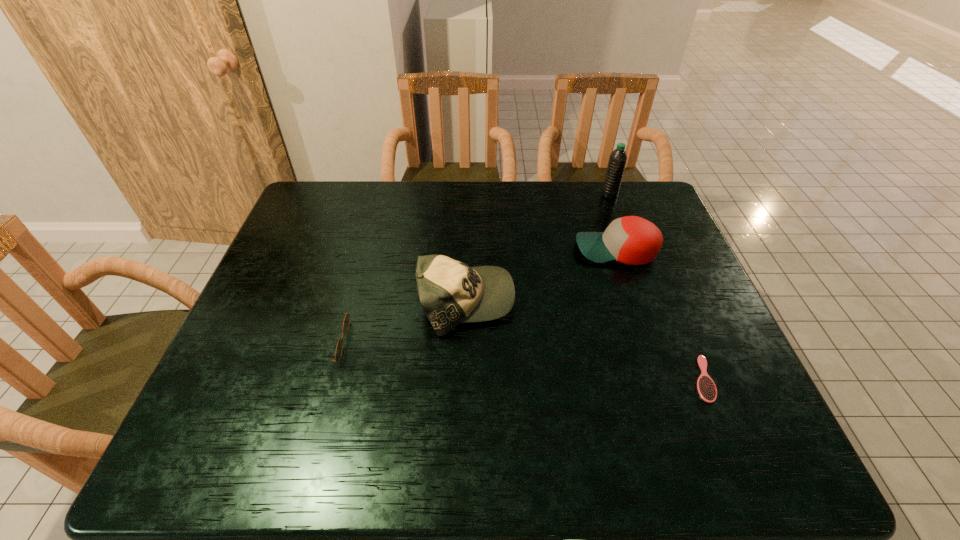
Image resolution: width=960 pixels, height=540 pixels. I want to click on the tallest object, so click(617, 161).

Identify the location of water bottle. pos(617,161).

The image size is (960, 540). I want to click on the nearer baseball cap, so click(x=451, y=292).

Where is `the left baseball cap`? The height and width of the screenshot is (540, 960). the left baseball cap is located at coordinates (451, 292).

Locate an element on the screen. the farther baseball cap is located at coordinates (633, 240).

Find the location of `the fourth nearest object`. the fourth nearest object is located at coordinates (633, 240).

Find the location of a particular element. the second shortest object is located at coordinates (339, 347).

Find the location of a particular element. sunglasses is located at coordinates (339, 347).

Find the location of a particular element. This screenshot has width=960, height=540. the shortest object is located at coordinates (707, 390).

This screenshot has height=540, width=960. Find the location of `vacant region located 0.340m on the left of the water bottle`. vacant region located 0.340m on the left of the water bottle is located at coordinates (500, 195).